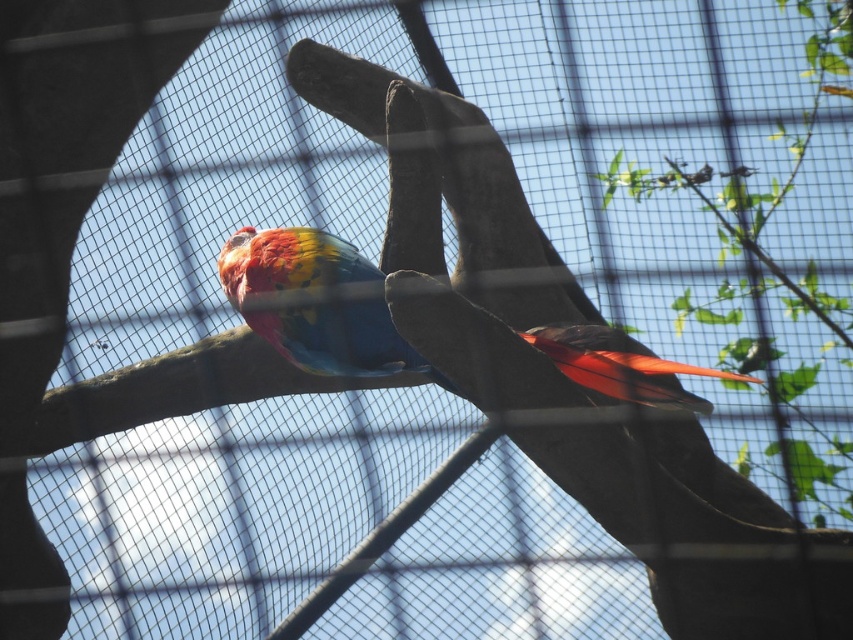
Question: Which point is closer to the camera?

Choices:
 (A) (366, 355)
 (B) (657, 360)

Answer: (B)

Question: Does shiny red feathers at right have a lesser width compared to shiny metallic bird at upper center?

Choices:
 (A) yes
 (B) no

Answer: (B)

Question: Which object is farther from the camera taking this photo?

Choices:
 (A) shiny multicolored parrot at center
 (B) shiny red feathers at right
 (C) shiny metallic bird at upper center

Answer: (C)

Question: In this image, where is shiny multicolored parrot at center located relative to shiny metallic bird at upper center?

Choices:
 (A) above
 (B) below

Answer: (B)

Question: Does shiny red feathers at right appear on the right side of shiny metallic bird at upper center?

Choices:
 (A) yes
 (B) no

Answer: (B)

Question: Which point is closer to the camera?

Choices:
 (A) (689, 406)
 (B) (718, 172)

Answer: (A)